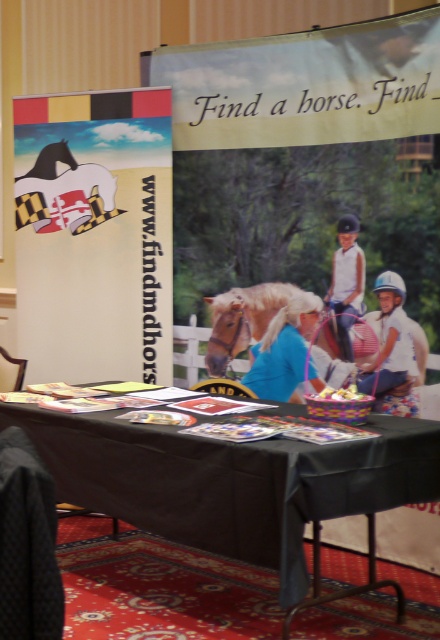
You are setting up a promotional booth and need to place a 20 cm wide decorative item between the light blue fabric at center and the blonde mane horse at center. Can you fit it there?

The light blue fabric at center and the blonde mane horse at center are 21.00 centimeters apart. Since the decorative item is 20 cm wide, it can fit between them with 1 cm of space remaining.

You are an event planner who needs to place a 12 inch wide decorative item between the white cotton shirt at center and the blonde mane horse at center. Is there enough space for it?

The distance between the white cotton shirt at center and the blonde mane horse at center is 18.54 inches, so yes, there is enough space to place a 12 inch wide decorative item between them.

You are attending an event and see the white cotton shirt at center and the blonde mane horse at center. Which object takes up more space in the image?

The blonde mane horse at center takes up more space in the image because it is larger than the white cotton shirt at center.